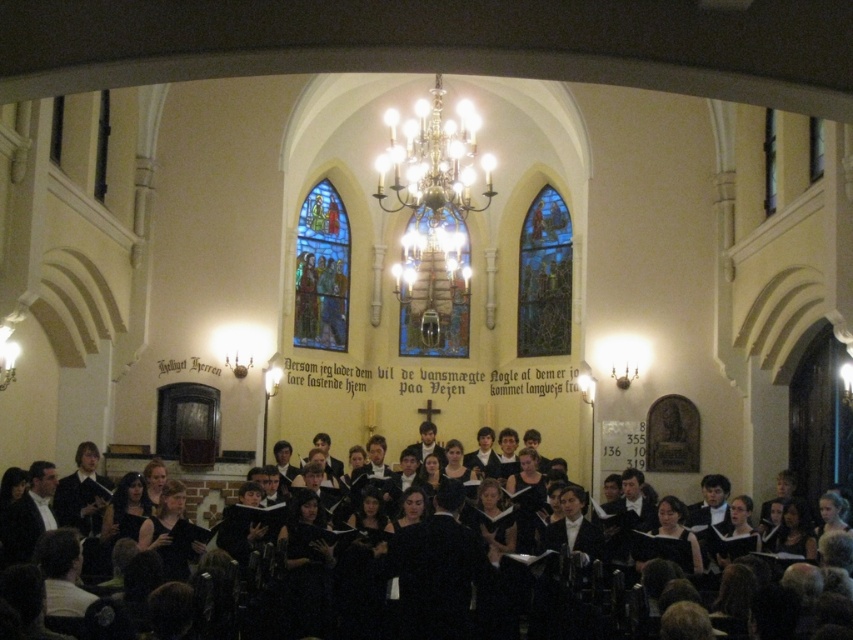
Question: Can you confirm if black matte choir robe at center is thinner than stained glass window at upper left?

Choices:
 (A) no
 (B) yes

Answer: (A)

Question: Can you confirm if black matte choir robe at center is thinner than stained glass window at upper center?

Choices:
 (A) no
 (B) yes

Answer: (A)

Question: Which point is farther from the camera taking this photo?

Choices:
 (A) (589, 634)
 (B) (466, 310)

Answer: (B)

Question: Considering the relative positions of stained glass window at upper center and stained glass window at center in the image provided, where is stained glass window at upper center located with respect to stained glass window at center?

Choices:
 (A) right
 (B) left

Answer: (A)

Question: Among these objects, which one is nearest to the camera?

Choices:
 (A) black matte choir robe at center
 (B) stained glass window at upper left
 (C) stained glass window at center

Answer: (A)

Question: Which is nearer to the stained glass window at upper center?

Choices:
 (A) black matte choir robe at center
 (B) stained glass window at center

Answer: (B)